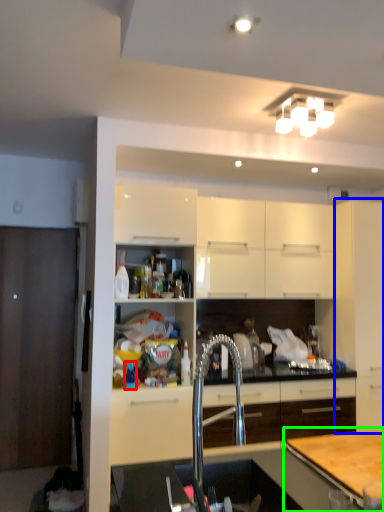
Question: Based on their relative distances, which object is farther from bottle (highlighted by a red box)? Choose from cabinetry (highlighted by a blue box) and table (highlighted by a green box).

Choices:
 (A) cabinetry
 (B) table

Answer: (A)